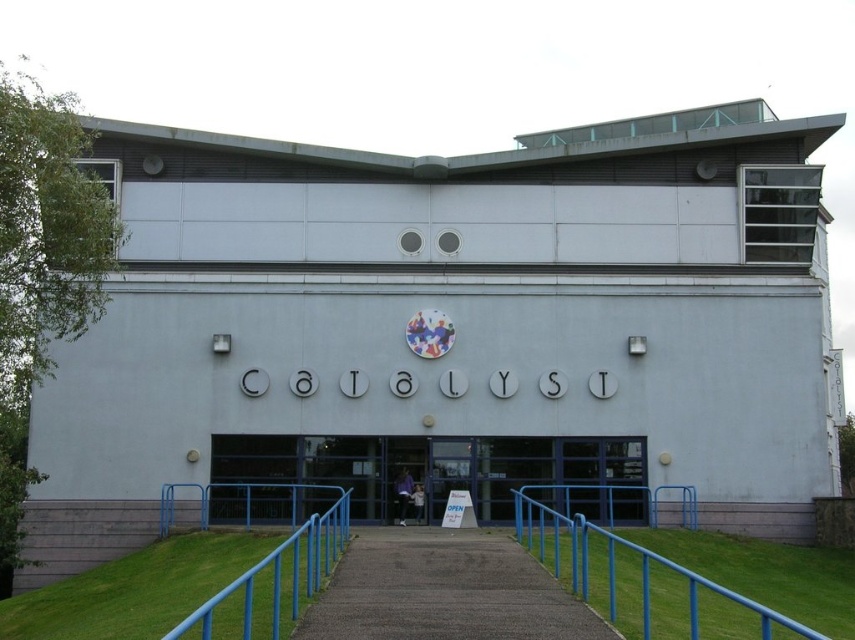
Question: Which of the following is the farthest from the observer?

Choices:
 (A) (505, 536)
 (B) (274, 624)
 (C) (628, 605)

Answer: (A)

Question: Is concrete paved path at center bigger than blue metal railing at center?

Choices:
 (A) no
 (B) yes

Answer: (A)

Question: Is concrete paved path at center smaller than blue metal railing at lower center?

Choices:
 (A) yes
 (B) no

Answer: (A)

Question: Is concrete paved path at center smaller than blue metal railing at lower center?

Choices:
 (A) yes
 (B) no

Answer: (A)

Question: Considering the real-world distances, which object is closest to the concrete paved path at center?

Choices:
 (A) blue metal railing at lower center
 (B) blue metal railing at center

Answer: (B)

Question: Which object appears farthest from the camera in this image?

Choices:
 (A) blue metal railing at center
 (B) blue metal railing at lower center

Answer: (B)